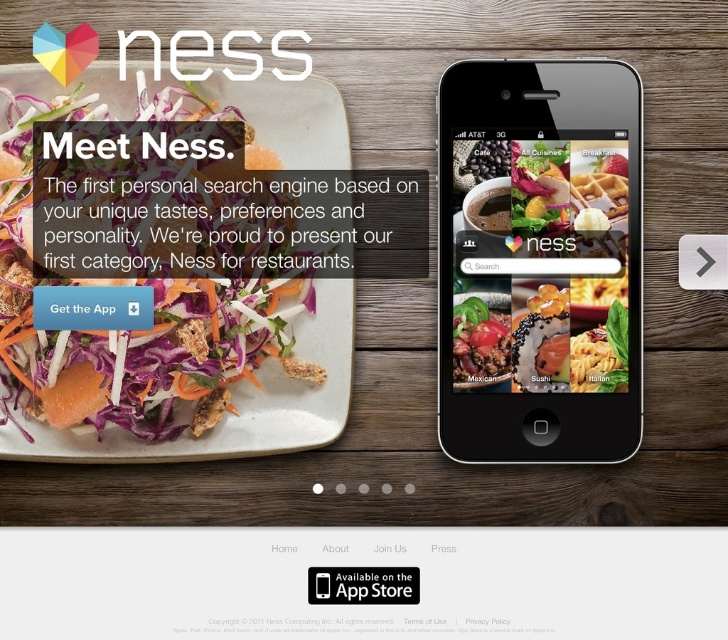
Is point (462, 400) less distant than point (306, 292)?

Yes, point (462, 400) is in front of point (306, 292).

Between point (494, 200) and point (20, 403), which one is positioned behind?

Point (494, 200)

Where is `black glossy smartphone at upper right`? The height and width of the screenshot is (640, 728). black glossy smartphone at upper right is located at coordinates (539, 260).

Is point (510, 237) farther from viewer compared to point (617, 186)?

Yes, point (510, 237) is behind point (617, 186).

Can you confirm if black glossy smartphone at upper right is positioned above smooth matte waffle at center?

No, black glossy smartphone at upper right is not above smooth matte waffle at center.

Does point (478, 168) come in front of point (478, 182)?

That is True.

You are a GUI agent. You are given a task and a screenshot of the screen. Output one action in this format:
    pyautogui.click(x=<x>, y=<y>)
    Task: Click on the black glossy smartphone at upper right
    The height and width of the screenshot is (640, 728).
    Given the screenshot: What is the action you would take?
    pyautogui.click(x=539, y=260)

Where is `black glossy smartphone at upper right`? black glossy smartphone at upper right is located at coordinates (539, 260).

Can you confirm if black glossy smartphone at upper right is positioned to the right of shiny metallic taco at center?

Indeed, black glossy smartphone at upper right is positioned on the right side of shiny metallic taco at center.

Which is in front, point (514, 252) or point (480, 324)?

Positioned in front is point (514, 252).

The image size is (728, 640). In order to click on black glossy smartphone at upper right in this screenshot , I will do `click(539, 260)`.